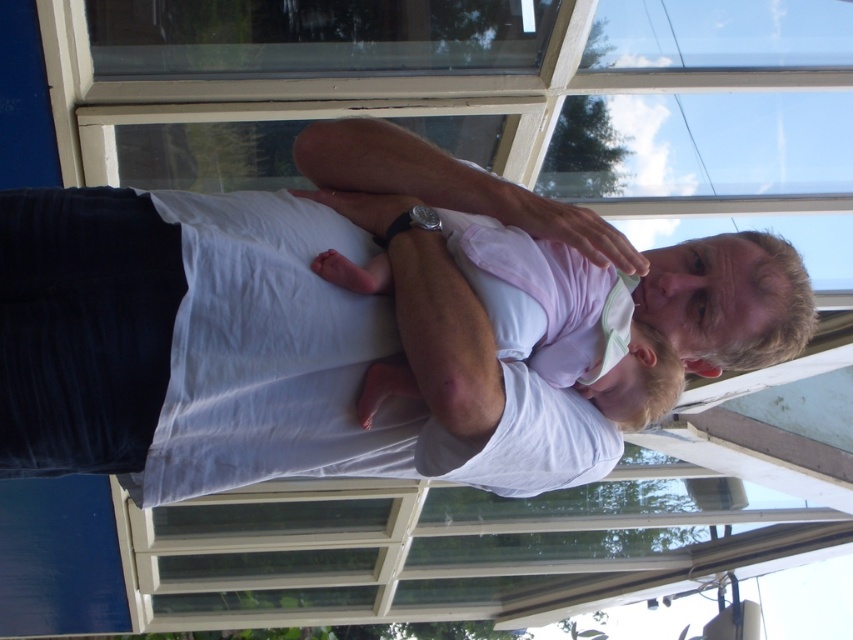
You are a photographer trying to capture a closeup shot of the man and baby. You notice two points in the image at coordinates point (33, 282) and point (660, 365). Which point should you focus on to ensure the subject is sharp, considering their proximity to the camera?

You should focus on point (33, 282) because it is closer to the camera than point (660, 365), making it the better choice for a sharp closeup of the subject.